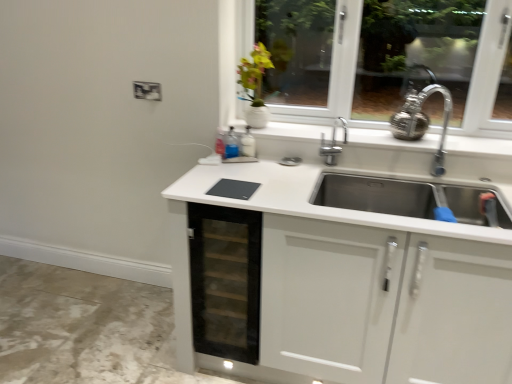
What are the coordinates of `vacant point above transparent glass drawer at center (from a real-world perspective)` in the screenshot? It's located at (239, 180).